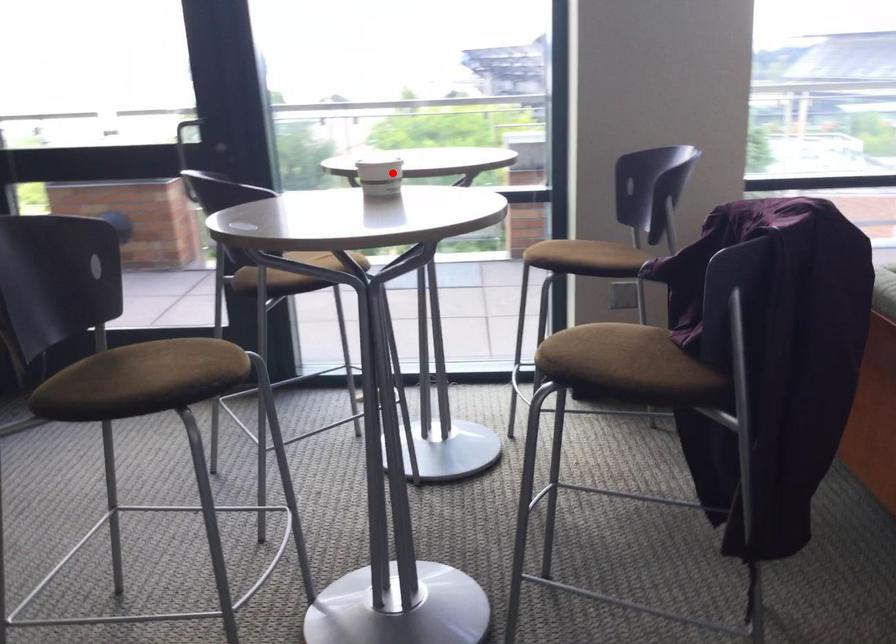
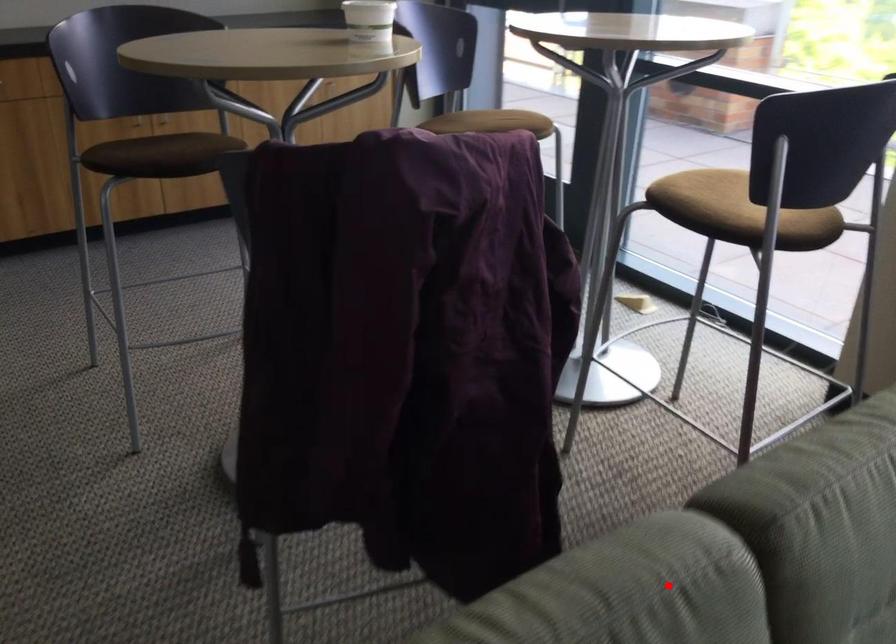
I am providing you with two images of the same scene from different viewpoints. A red point is marked on the first image and another point is marked on the second image. Is the marked point in image1 the same physical position as the marked point in image2?

No